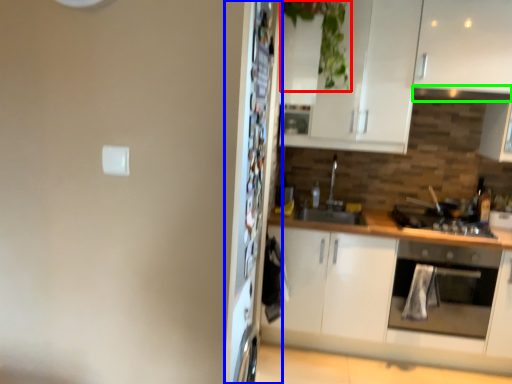
Question: Considering the real-world distances, which object is closest to plant (highlighted by a red box)? fridge (highlighted by a blue box) or exhaust hood (highlighted by a green box).

Choices:
 (A) fridge
 (B) exhaust hood

Answer: (B)